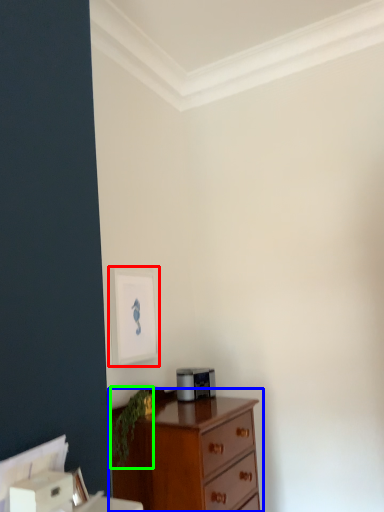
Question: Which is nearer to the picture frame (highlighted by a red box)? chest of drawers (highlighted by a blue box) or plant (highlighted by a green box).

Choices:
 (A) chest of drawers
 (B) plant

Answer: (B)